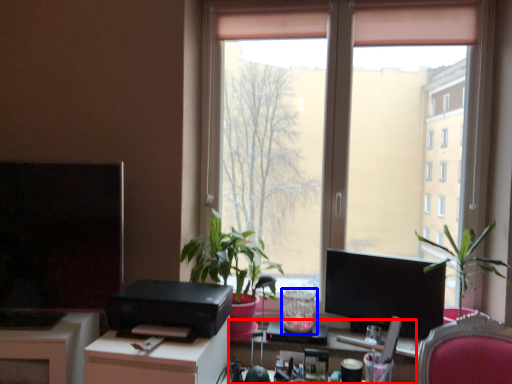
Question: Which point is further to the camera, computer desk (highlighted by a red box) or glass vase (highlighted by a blue box)?

Choices:
 (A) computer desk
 (B) glass vase

Answer: (B)